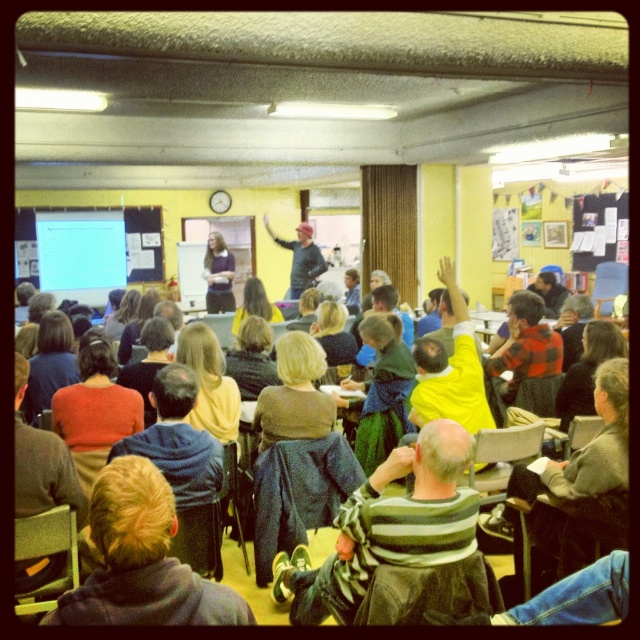
You are a photographer trying to capture a group photo of the matte black shirt at center and the dark blue sweater at center. Since you want to ensure both are clearly visible, which object should you focus on first to avoid blurring due to their size difference?

The matte black shirt at center is thinner than the dark blue sweater at center, so you should focus on the matte black shirt at center first to ensure clarity before adjusting for the larger object.

You are a student sitting in the classroom and you see the striped sweater at center and the dark blue sweater at center. Which sweater is closer to the ground?

The striped sweater at center is positioned under the dark blue sweater at center, so the striped sweater at center is closer to the ground.